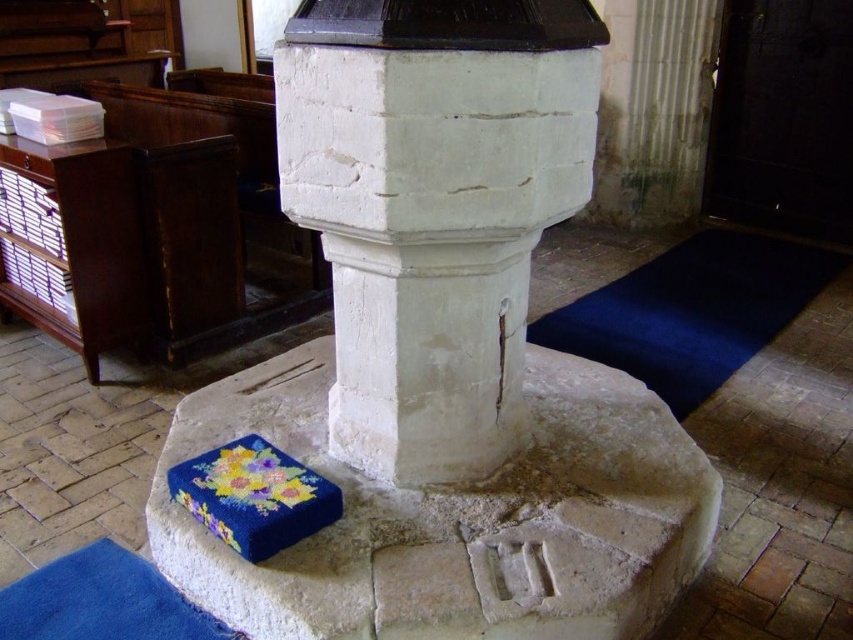
You are an interior designer planning to place a new decorative item in the church. You have a 1.2 meter wide sculpture that you want to position between the white stone pillar at center and the blue felt box at lower left. Based on their widths, will the sculpture fit between them?

The white stone pillar at center is narrower than the blue felt box at lower left. However, the exact distance between them isn t specified. The sculpture requires 1.2 meters of space, but without knowing the actual gap between the two objects, it s impossible to determine if it will fit.

You are an interior designer planning to install a new light fixture. You see the white stone pillar at center and the blue felt box at lower left. Which object should you place the light fixture above to ensure it aligns with the existing spatial arrangement?

The white stone pillar at center is above the blue felt box at lower left, so placing the light fixture above the white stone pillar at center would align with the existing spatial arrangement.

You are standing in the church and want to place a small statue exactly at the point marked as point (433, 208). What object will the statue be placed next to?

The small statue will be placed next to the white stone pillar at center located at point (433, 208).